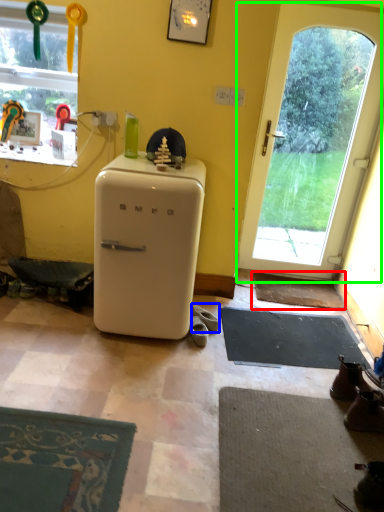
Question: Based on their relative distances, which object is nearer to doormat (highlighted by a red box)? Choose from footwear (highlighted by a blue box) and door (highlighted by a green box).

Choices:
 (A) footwear
 (B) door

Answer: (B)